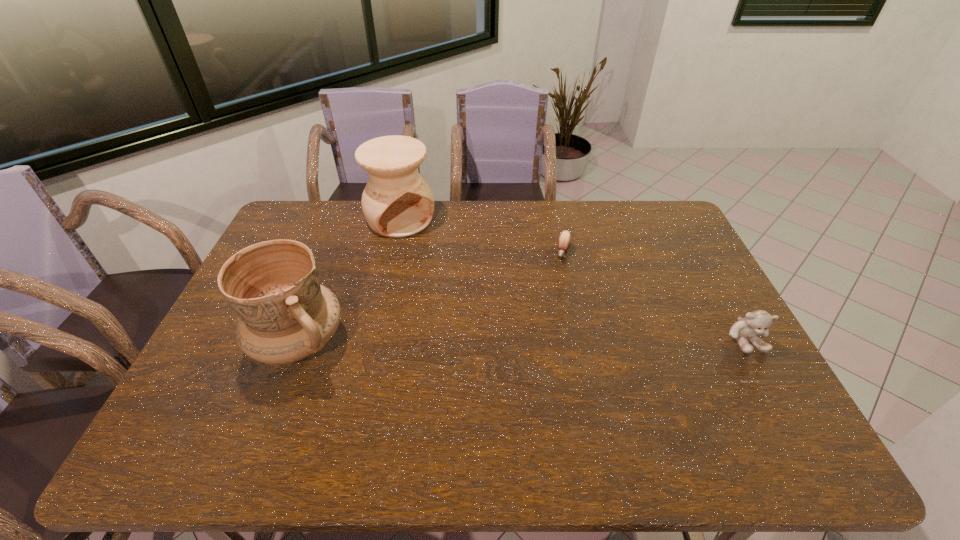
Identify the location of vacant space at the right edge of the desktop. (703, 318).

Locate an element on the screen. vacant space at the far left corner is located at coordinates (319, 224).

This screenshot has width=960, height=540. What are the coordinates of `blank space at the far right corner` in the screenshot? It's located at (661, 203).

Find the location of a particular element. Image resolution: width=960 pixels, height=540 pixels. vacant space in between the farther pottery and the escargot is located at coordinates (482, 236).

Identify the location of free space between the escargot and the teddy bear. (654, 296).

What are the coordinates of `empty location between the nearer pottery and the shortest object` in the screenshot? It's located at (431, 298).

Find the location of a particular element. Image resolution: width=960 pixels, height=540 pixels. free area in between the rightmost object and the nearer pottery is located at coordinates 522,341.

Identify the location of vacant area between the farthest object and the rightmost object. The height and width of the screenshot is (540, 960). (573, 279).

This screenshot has height=540, width=960. In order to click on free space between the teddy bear and the farthest object in this screenshot , I will do `click(573, 279)`.

You are a GUI agent. You are given a task and a screenshot of the screen. Output one action in this format:
    pyautogui.click(x=<x>, y=<y>)
    Task: Click on the free space between the rightmost object and the farther pottery
    Image resolution: width=960 pixels, height=540 pixels.
    Given the screenshot: What is the action you would take?
    pyautogui.click(x=573, y=279)